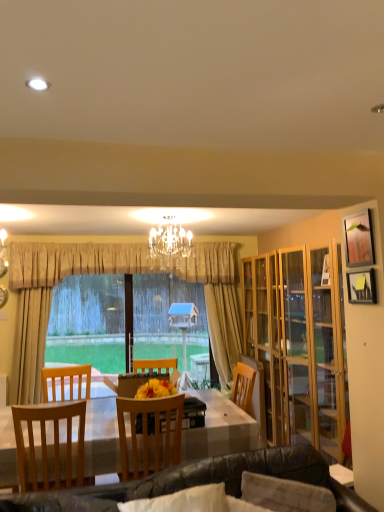
The height and width of the screenshot is (512, 384). Describe the element at coordinates (299, 344) in the screenshot. I see `wooden cabinet at right` at that location.

What is the approximate width of wooden cabinet at right?

wooden cabinet at right is 15.41 inches in width.

Describe the element at coordinates (51, 297) in the screenshot. The height and width of the screenshot is (512, 384). I see `beige fabric curtain at center` at that location.

Find the location of a particular element. Image resolution: width=384 pixels, height=512 pixels. beige fabric curtain at center is located at coordinates (51, 297).

At what (x,y) coordinates should I click in order to perform the action: click on wooden picture frame at upper right, the 1th picture frame from the top. Please return your answer as a coordinate pair (x, y). Looking at the image, I should click on (359, 240).

Locate an element on the screen. Image resolution: width=384 pixels, height=512 pixels. crystal chandelier at center is located at coordinates (169, 245).

The height and width of the screenshot is (512, 384). In order to click on wooden cabinet at right in this screenshot , I will do `click(299, 344)`.

Which is more to the left, leather couch at lower center or wooden picture frame at upper right, marked as the second picture frame in a top-to-bottom arrangement?

leather couch at lower center.

Is leather couch at lower center situated inside wooden picture frame at upper right, the first picture frame in the bottom-to-top sequence, or outside?

The correct answer is: outside.

From the image's perspective, which is below, leather couch at lower center or wooden picture frame at upper right, marked as the second picture frame in a top-to-bottom arrangement?

leather couch at lower center is shown below in the image.

Considering the relative sizes of leather couch at lower center and wooden picture frame at upper right, marked as the second picture frame in a top-to-bottom arrangement, in the image provided, is leather couch at lower center bigger than wooden picture frame at upper right, marked as the second picture frame in a top-to-bottom arrangement,?

Correct, leather couch at lower center is larger in size than wooden picture frame at upper right, marked as the second picture frame in a top-to-bottom arrangement.

Is leather couch at lower center next to wooden table at center?

No, leather couch at lower center is not beside wooden table at center.

Consider the image. Which object is wider, leather couch at lower center or wooden table at center?

Wider between the two is wooden table at center.

From a real-world perspective, which is physically below, leather couch at lower center or wooden table at center?

wooden table at center, from a real-world perspective.

Is wooden table at center a part of leather couch at lower center?

No, wooden table at center is not surrounded by leather couch at lower center.

Which object is closer to the camera taking this photo, wooden picture frame at upper right, the 1th picture frame from the top, or wooden chair at center, which is the second chair from left to right?

wooden picture frame at upper right, the 1th picture frame from the top, is more forward.

Who is taller, wooden picture frame at upper right, the 1th picture frame from the top, or wooden chair at center, the 1th chair viewed from the right?

wooden chair at center, the 1th chair viewed from the right.

In the image, is wooden picture frame at upper right, the 1th picture frame from the top, on the left side or the right side of wooden chair at center, the 1th chair viewed from the right?

In the image, wooden picture frame at upper right, the 1th picture frame from the top, appears on the right side of wooden chair at center, the 1th chair viewed from the right.

Considering the sizes of objects wooden picture frame at upper right, which is the second picture frame in bottom-to-top order, and wooden chair at center, the 1th chair viewed from the right, in the image provided, who is wider, wooden picture frame at upper right, which is the second picture frame in bottom-to-top order, or wooden chair at center, the 1th chair viewed from the right,?

wooden chair at center, the 1th chair viewed from the right, is wider.

Who is taller, light brown wooden chair at left, the 1th chair from the left, or wooden picture frame at upper right, marked as the second picture frame in a top-to-bottom arrangement?

Standing taller between the two is light brown wooden chair at left, the 1th chair from the left.

From a real-world perspective, is light brown wooden chair at left, the 1th chair from the left, physically above wooden picture frame at upper right, the first picture frame in the bottom-to-top sequence?

No.

Is point (69, 468) positioned after point (353, 285)?

Yes, point (69, 468) is behind point (353, 285).

Are light brown wooden chair at left, the 2th chair when ordered from right to left, and wooden picture frame at upper right, marked as the second picture frame in a top-to-bottom arrangement, located far from each other?

Absolutely, light brown wooden chair at left, the 2th chair when ordered from right to left, is distant from wooden picture frame at upper right, marked as the second picture frame in a top-to-bottom arrangement.

Is wooden picture frame at upper right, marked as the second picture frame in a top-to-bottom arrangement, aimed at wooden cabinet at right?

No, wooden picture frame at upper right, marked as the second picture frame in a top-to-bottom arrangement, is not aimed at wooden cabinet at right.

Is wooden picture frame at upper right, the first picture frame in the bottom-to-top sequence, not close to wooden cabinet at right?

Absolutely, wooden picture frame at upper right, the first picture frame in the bottom-to-top sequence, is distant from wooden cabinet at right.

Considering the sizes of objects wooden picture frame at upper right, marked as the second picture frame in a top-to-bottom arrangement, and wooden cabinet at right in the image provided, who is thinner, wooden picture frame at upper right, marked as the second picture frame in a top-to-bottom arrangement, or wooden cabinet at right?

With smaller width is wooden picture frame at upper right, marked as the second picture frame in a top-to-bottom arrangement.

In the scene shown: In terms of width, does wooden cabinet at right look wider or thinner when compared to light brown wooden chair at left, the 1th chair from the left?

Clearly, wooden cabinet at right has less width compared to light brown wooden chair at left, the 1th chair from the left.

Is wooden cabinet at right aimed at light brown wooden chair at left, the 2th chair when ordered from right to left?

Yes, wooden cabinet at right is oriented towards light brown wooden chair at left, the 2th chair when ordered from right to left.

Is wooden cabinet at right to the left of light brown wooden chair at left, the 1th chair from the left, from the viewer's perspective?

In fact, wooden cabinet at right is to the right of light brown wooden chair at left, the 1th chair from the left.

Does wooden cabinet at right have a lesser height compared to light brown wooden chair at left, the 1th chair from the left?

Incorrect, the height of wooden cabinet at right does not fall short of that of light brown wooden chair at left, the 1th chair from the left.

Considering the positions of points (358, 273) and (160, 245), is point (358, 273) closer to camera compared to point (160, 245)?

Yes, it is in front of point (160, 245).

Considering the sizes of wooden picture frame at upper right, marked as the second picture frame in a top-to-bottom arrangement, and crystal chandelier at center in the image, is wooden picture frame at upper right, marked as the second picture frame in a top-to-bottom arrangement, taller or shorter than crystal chandelier at center?

Considering their sizes, wooden picture frame at upper right, marked as the second picture frame in a top-to-bottom arrangement, has less height than crystal chandelier at center.

How many degrees apart are the facing directions of wooden picture frame at upper right, the first picture frame in the bottom-to-top sequence, and crystal chandelier at center?

There is a 89.4-degree angle between the facing directions of wooden picture frame at upper right, the first picture frame in the bottom-to-top sequence, and crystal chandelier at center.

Which object is further away from the camera taking this photo, wooden picture frame at upper right, marked as the second picture frame in a top-to-bottom arrangement, or crystal chandelier at center?

crystal chandelier at center is further from the camera.

Identify the location of studio couch located below the wooden picture frame at upper right, the first picture frame in the bottom-to-top sequence (from the image's perspective). (197, 482).

Find the location of a particular element. This screenshot has width=384, height=512. desk below the leather couch at lower center (from a real-world perspective) is located at coordinates (220, 430).

Estimate the real-world distances between objects in this image. Which object is closer to wooden picture frame at upper right, the first picture frame in the bottom-to-top sequence, wooden cabinet at right or crystal chandelier at center?

wooden cabinet at right lies closer to wooden picture frame at upper right, the first picture frame in the bottom-to-top sequence, than the other object.

In the scene shown: From the image, which object appears to be farther from leather couch at lower center, crystal chandelier at center or beige fabric curtain at center?

beige fabric curtain at center is further to leather couch at lower center.

Based on their spatial positions, is wooden chair at center, which is the second chair from left to right, or crystal chandelier at center closer to wooden cabinet at right?

Among the two, wooden chair at center, which is the second chair from left to right, is located nearer to wooden cabinet at right.

Based on their spatial positions, is leather couch at lower center or wooden picture frame at upper right, the 1th picture frame from the top, closer to wooden table at center?

Among the two, leather couch at lower center is located nearer to wooden table at center.

Looking at the image, which one is located closer to wooden table at center, wooden chair at center, the 1th chair viewed from the right, or wooden picture frame at upper right, marked as the second picture frame in a top-to-bottom arrangement?

wooden chair at center, the 1th chair viewed from the right, is closer to wooden table at center.

From the image, which object appears to be nearer to wooden picture frame at upper right, marked as the second picture frame in a top-to-bottom arrangement, leather couch at lower center or light brown wooden chair at left, the 2th chair when ordered from right to left?

leather couch at lower center lies closer to wooden picture frame at upper right, marked as the second picture frame in a top-to-bottom arrangement, than the other object.

Considering their positions, is wooden chair at center, which is the second chair from left to right, positioned further to wooden picture frame at upper right, which is the second picture frame in bottom-to-top order, than beige fabric curtain at center?

beige fabric curtain at center.

Based on the photo, which object lies nearer to the anchor point wooden chair at center, the 1th chair viewed from the right, light brown wooden chair at left, the 2th chair when ordered from right to left, or wooden table at center?

Among the two, wooden table at center is located nearer to wooden chair at center, the 1th chair viewed from the right.

The width and height of the screenshot is (384, 512). I want to click on desk between wooden picture frame at upper right, which is the second picture frame in bottom-to-top order, and beige fabric curtain at center in the front-back direction, so click(220, 430).

You are a GUI agent. You are given a task and a screenshot of the screen. Output one action in this format:
    pyautogui.click(x=<x>, y=<y>)
    Task: Click on the cabinetry between wooden picture frame at upper right, the 1th picture frame from the top, and crystal chandelier at center, along the z-axis
    The height and width of the screenshot is (512, 384).
    Given the screenshot: What is the action you would take?
    pyautogui.click(x=299, y=344)

Find the location of a particular element. picture frame located between wooden picture frame at upper right, the first picture frame in the bottom-to-top sequence, and wooden cabinet at right in the depth direction is located at coordinates (359, 240).

Where is `lamp positioned between wooden picture frame at upper right, the first picture frame in the bottom-to-top sequence, and beige fabric curtain at center from near to far`? The height and width of the screenshot is (512, 384). lamp positioned between wooden picture frame at upper right, the first picture frame in the bottom-to-top sequence, and beige fabric curtain at center from near to far is located at coordinates (169, 245).